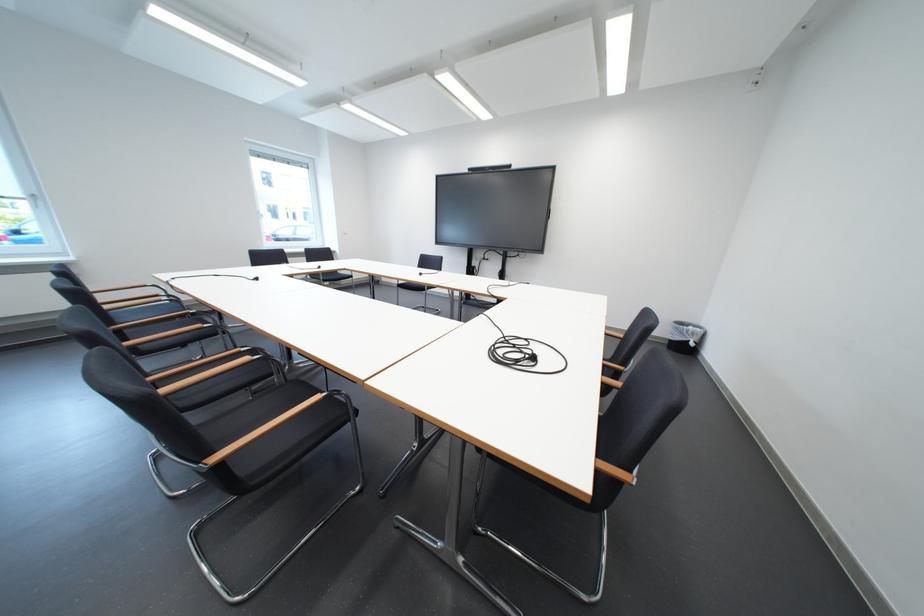
What do you see at coordinates (226, 424) in the screenshot? I see `the black chair sitting surface` at bounding box center [226, 424].